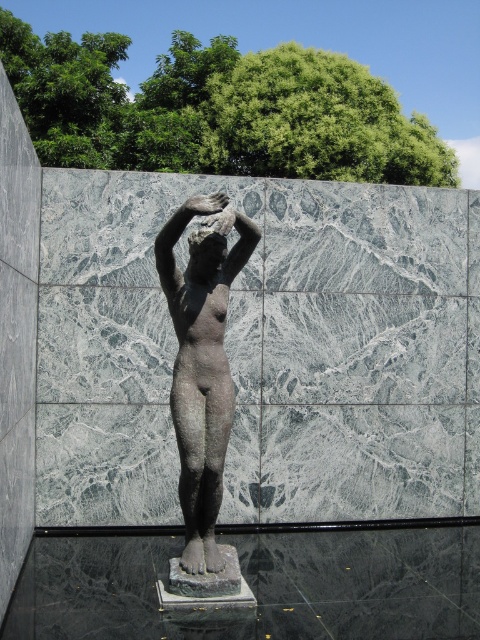
You are an art curator planning to display both the bronze statue at center and the matte bronze head at center in a gallery. Given their sizes, which one should be placed on the taller pedestal to ensure proper visibility?

The bronze statue at center is larger in size than the matte bronze head at center, so it should be placed on the taller pedestal to ensure proper visibility.

You are an art conservator examining the statue from the front. You notice that the bronze statue at center and the matte bronze head at center are part of the same sculpture. Which part of the sculpture is positioned closer to you?

The bronze statue at center is closer to the viewer than the matte bronze head at center.